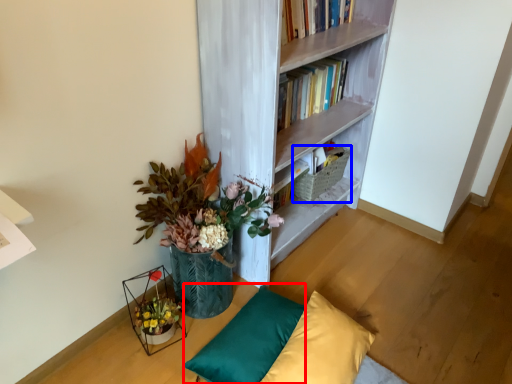
Question: Among these objects, which one is farthest to the camera, pillow (highlighted by a red box) or basket (highlighted by a blue box)?

Choices:
 (A) pillow
 (B) basket

Answer: (B)